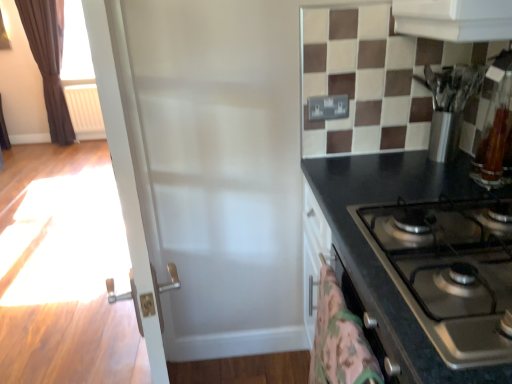
Question: From a real-world perspective, is white plastic radiator at left physically located above or below brown velvet curtain at left?

Choices:
 (A) below
 (B) above

Answer: (A)

Question: From the image's perspective, relative to brown velvet curtain at left, is white plastic radiator at left above or below?

Choices:
 (A) below
 (B) above

Answer: (A)

Question: Estimate the real-world distances between objects in this image. Which object is farther from the white plastic radiator at left?

Choices:
 (A) fluffy pink blanket at lower right
 (B) brown velvet curtain at left
 (C) black glossy countertop at right
 (D) stainless steel knife block at upper right
 (E) white glossy door at center

Answer: (A)

Question: Which is nearer to the white glossy door at center?

Choices:
 (A) black glossy countertop at right
 (B) fluffy pink blanket at lower right
 (C) brown velvet curtain at left
 (D) white plastic radiator at left
 (E) stainless steel knife block at upper right

Answer: (B)